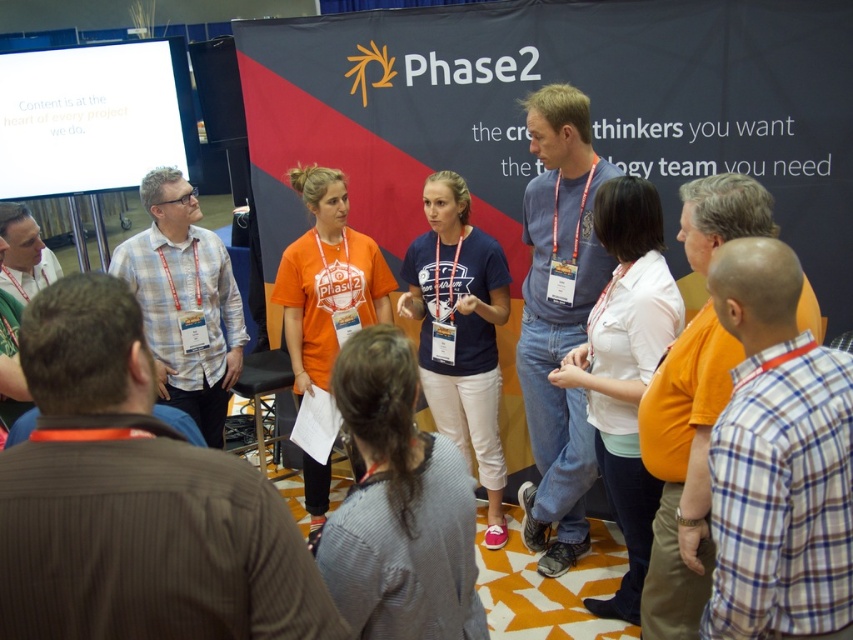
Question: Which point is farther to the camera?

Choices:
 (A) (677, 608)
 (B) (567, 346)
 (C) (115, 500)
 (D) (56, 260)

Answer: (D)

Question: Where is brown pinstripe shirt at center located in relation to matte black shirt at left in the image?

Choices:
 (A) below
 (B) above

Answer: (A)

Question: Does brown pinstripe shirt at center come in front of white checkered shirt at center?

Choices:
 (A) no
 (B) yes

Answer: (B)

Question: Which is nearer to the orange shirt at right?

Choices:
 (A) white checkered shirt at center
 (B) brown pinstripe shirt at center

Answer: (B)

Question: Which is nearer to the matte black shirt at left?

Choices:
 (A) orange shirt at right
 (B) brown pinstripe shirt at center
 (C) white checkered shirt at center

Answer: (C)

Question: Considering the relative positions of brown pinstripe shirt at center and orange shirt at right in the image provided, where is brown pinstripe shirt at center located with respect to orange shirt at right?

Choices:
 (A) above
 (B) below

Answer: (A)